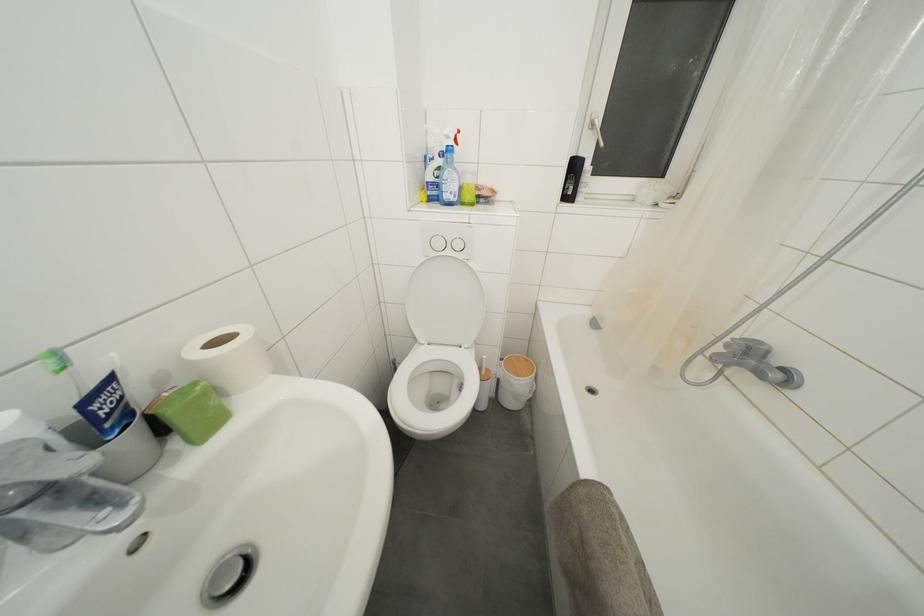
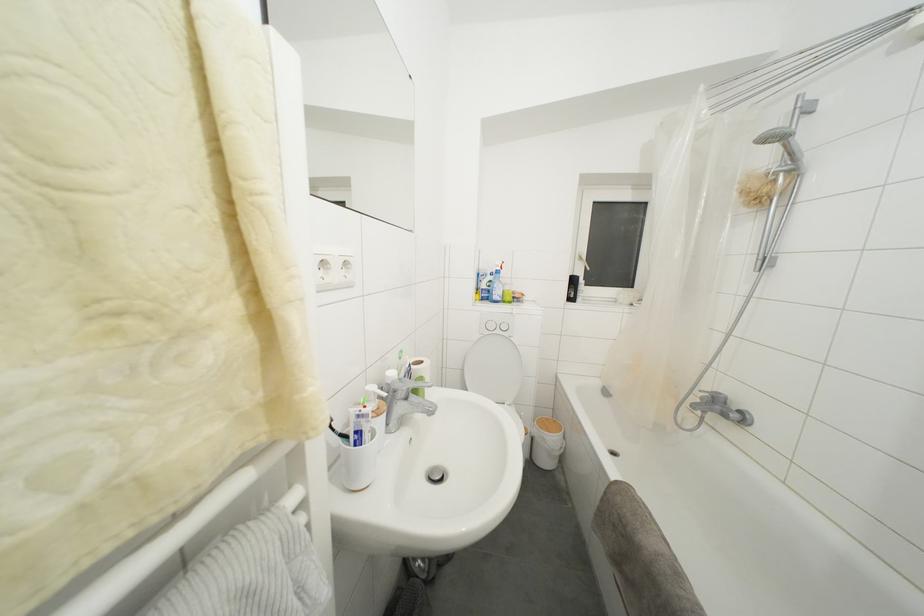
The images are taken continuously from a first-person perspective. In which direction are you moving?

The movement direction of the cameraman is left, backward.